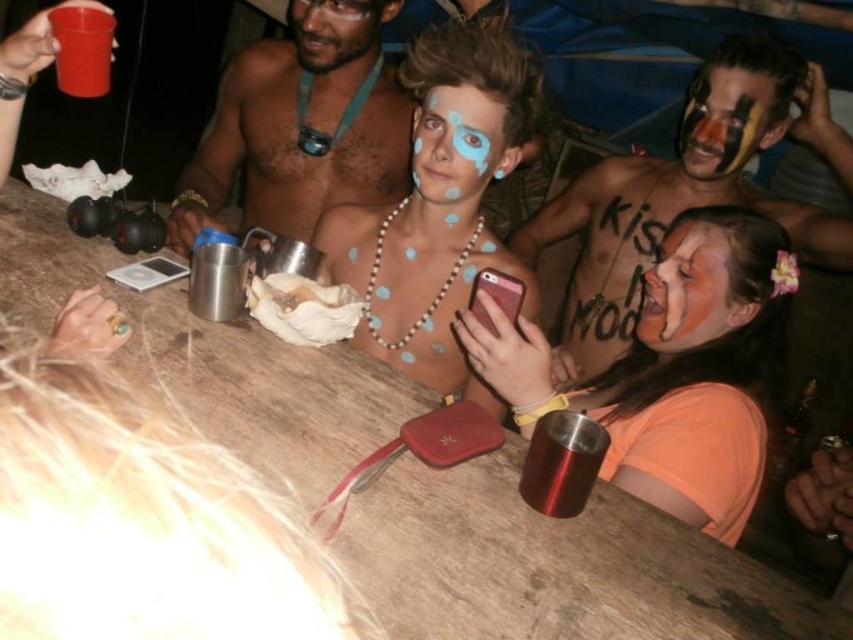
Does point (410, 138) come closer to viewer compared to point (84, 36)?

That is False.

Is matte blue paint at center positioned in front of rubber cup at upper left?

No, matte blue paint at center is further to the viewer.

Who is more forward, (421, 157) or (68, 48)?

Point (68, 48) is in front.

Find the location of a particular element. The width and height of the screenshot is (853, 640). matte blue paint at center is located at coordinates [x=457, y=144].

At what (x,y) coordinates should I click in order to perform the action: click on matte black face paint at lower right. Please return your answer as a coordinate pair (x, y). This screenshot has height=640, width=853. Looking at the image, I should click on (688, 291).

Who is taller, matte black face paint at lower right or metallic silver cup at lower center?

matte black face paint at lower right is taller.

The height and width of the screenshot is (640, 853). Identify the location of matte black face paint at lower right. (688, 291).

At what (x,y) coordinates should I click in order to perform the action: click on matte black face paint at lower right. Please return your answer as a coordinate pair (x, y). Image resolution: width=853 pixels, height=640 pixels. Looking at the image, I should click on (688, 291).

Does wooden table at center have a lesser height compared to matte skin at center?

No.

Does wooden table at center have a smaller size compared to matte skin at center?

No, wooden table at center is not smaller than matte skin at center.

Which is behind, point (527, 545) or point (194, 193)?

The point (194, 193) is behind.

In order to click on wooden table at center in this screenshot , I will do `click(554, 564)`.